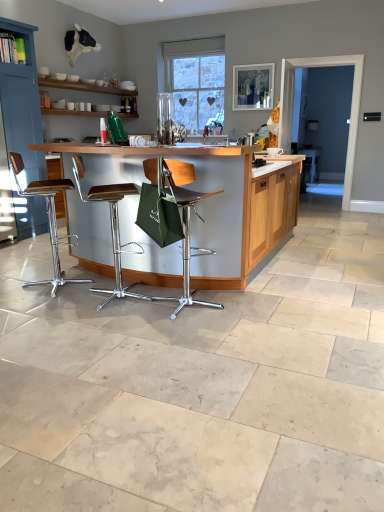
The height and width of the screenshot is (512, 384). Find the location of `free space in front of wooden table at center`. free space in front of wooden table at center is located at coordinates [x=188, y=356].